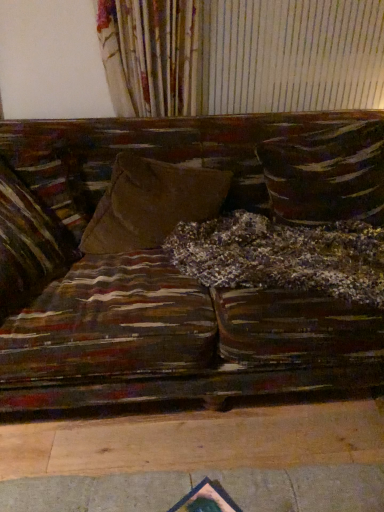
What do you see at coordinates (326, 172) in the screenshot? I see `textured brown pillow at center, the 3th pillow positioned from the left` at bounding box center [326, 172].

This screenshot has width=384, height=512. I want to click on textured brown pillow at center, the 1th pillow in the right-to-left sequence, so click(326, 172).

This screenshot has height=512, width=384. What do you see at coordinates (151, 203) in the screenshot?
I see `suede-like brown pillow at center, the second pillow when ordered from right to left` at bounding box center [151, 203].

This screenshot has width=384, height=512. Identify the location of textured brown pillow at center, the 1th pillow in the right-to-left sequence. (326, 172).

From a real-world perspective, which is physically below, suede-like brown pillow at center, which is the 2th pillow from left to right, or velvet brown pillow at left, positioned as the 3th pillow in right-to-left order?

suede-like brown pillow at center, which is the 2th pillow from left to right.

At what (x,y) coordinates should I click in order to perform the action: click on the 1st pillow above the velvet brown pillow at left, the 1th pillow positioned from the left (from the image's perspective). Please return your answer as a coordinate pair (x, y). Looking at the image, I should click on (151, 203).

Considering the sizes of objects suede-like brown pillow at center, which is the 2th pillow from left to right, and velvet brown pillow at left, the 1th pillow positioned from the left, in the image provided, who is bigger, suede-like brown pillow at center, which is the 2th pillow from left to right, or velvet brown pillow at left, the 1th pillow positioned from the left,?

suede-like brown pillow at center, which is the 2th pillow from left to right.

Is suede-like brown pillow at center, which is the 2th pillow from left to right, looking in the opposite direction of velvet brown pillow at left, positioned as the 3th pillow in right-to-left order?

No.

Is velvet brown pillow at left, the 1th pillow positioned from the left, positioned far away from suede-like brown pillow at center, which is the 2th pillow from left to right?

No.

Which is in front, point (24, 274) or point (147, 160)?

The point (24, 274) is in front.

From a real-world perspective, is velvet brown pillow at left, positioned as the 3th pillow in right-to-left order, above or below suede-like brown pillow at center, the second pillow when ordered from right to left?

In terms of real-world spatial position, velvet brown pillow at left, positioned as the 3th pillow in right-to-left order, is above suede-like brown pillow at center, the second pillow when ordered from right to left.

Considering the relative sizes of velvet brown pillow at left, positioned as the 3th pillow in right-to-left order, and textured brown pillow at center, the 3th pillow positioned from the left, in the image provided, is velvet brown pillow at left, positioned as the 3th pillow in right-to-left order, bigger than textured brown pillow at center, the 3th pillow positioned from the left,?

No, velvet brown pillow at left, positioned as the 3th pillow in right-to-left order, is not bigger than textured brown pillow at center, the 3th pillow positioned from the left.

Is velvet brown pillow at left, the 1th pillow positioned from the left, facing towards textured brown pillow at center, the 1th pillow in the right-to-left sequence?

No, velvet brown pillow at left, the 1th pillow positioned from the left, is not aimed at textured brown pillow at center, the 1th pillow in the right-to-left sequence.

Is velvet brown pillow at left, positioned as the 3th pillow in right-to-left order, taller than textured brown pillow at center, the 1th pillow in the right-to-left sequence?

Yes, velvet brown pillow at left, positioned as the 3th pillow in right-to-left order, is taller than textured brown pillow at center, the 1th pillow in the right-to-left sequence.

Between velvet brown pillow at left, positioned as the 3th pillow in right-to-left order, and textured brown pillow at center, the 3th pillow positioned from the left, which one appears on the right side from the viewer's perspective?

textured brown pillow at center, the 3th pillow positioned from the left, is more to the right.

Who is taller, textured brown pillow at center, the 3th pillow positioned from the left, or suede-like brown pillow at center, which is the 2th pillow from left to right?

textured brown pillow at center, the 3th pillow positioned from the left.

How many degrees apart are the facing directions of textured brown pillow at center, the 3th pillow positioned from the left, and suede-like brown pillow at center, which is the 2th pillow from left to right?

10.2 degrees.

Would you say textured brown pillow at center, the 1th pillow in the right-to-left sequence, is inside or outside suede-like brown pillow at center, the second pillow when ordered from right to left?

textured brown pillow at center, the 1th pillow in the right-to-left sequence, cannot be found inside suede-like brown pillow at center, the second pillow when ordered from right to left.

Does textured brown pillow at center, the 3th pillow positioned from the left, have a larger size compared to suede-like brown pillow at center, which is the 2th pillow from left to right?

Yes.

Between textured brown pillow at center, the 3th pillow positioned from the left, and velvet brown pillow at left, the 1th pillow positioned from the left, which one has larger size?

textured brown pillow at center, the 3th pillow positioned from the left.

Which object is further away from the camera, textured brown pillow at center, the 3th pillow positioned from the left, or velvet brown pillow at left, positioned as the 3th pillow in right-to-left order?

textured brown pillow at center, the 3th pillow positioned from the left, is more distant.

From a real-world perspective, is textured brown pillow at center, the 3th pillow positioned from the left, below velvet brown pillow at left, the 1th pillow positioned from the left?

Yes, from a real-world perspective, textured brown pillow at center, the 3th pillow positioned from the left, is under velvet brown pillow at left, the 1th pillow positioned from the left.

Does suede-like brown pillow at center, which is the 2th pillow from left to right, have a smaller size compared to textured brown pillow at center, the 3th pillow positioned from the left?

Yes.

Who is taller, suede-like brown pillow at center, which is the 2th pillow from left to right, or textured brown pillow at center, the 3th pillow positioned from the left?

textured brown pillow at center, the 3th pillow positioned from the left.

Can you confirm if suede-like brown pillow at center, which is the 2th pillow from left to right, is positioned to the right of textured brown pillow at center, the 1th pillow in the right-to-left sequence?

No, suede-like brown pillow at center, which is the 2th pillow from left to right, is not to the right of textured brown pillow at center, the 1th pillow in the right-to-left sequence.

Between point (146, 178) and point (349, 126), which one is positioned behind?

Positioned behind is point (349, 126).

You are a GUI agent. You are given a task and a screenshot of the screen. Output one action in this format:
    pyautogui.click(x=<x>, y=<y>)
    Task: Click on the pillow that is the 1st object located behind the velvet brown pillow at left, positioned as the 3th pillow in right-to-left order
    Image resolution: width=384 pixels, height=512 pixels.
    Given the screenshot: What is the action you would take?
    pyautogui.click(x=151, y=203)

From a real-world perspective, starting from the suede-like brown pillow at center, which is the 2th pillow from left to right, which pillow is the 2nd one vertically above it? Please provide its 2D coordinates.

[(28, 244)]

Estimate the real-world distances between objects in this image. Which object is closer to velvet brown pillow at left, the 1th pillow positioned from the left, suede-like brown pillow at center, the second pillow when ordered from right to left, or textured brown pillow at center, the 3th pillow positioned from the left?

suede-like brown pillow at center, the second pillow when ordered from right to left, lies closer to velvet brown pillow at left, the 1th pillow positioned from the left, than the other object.

Considering their positions, is velvet brown pillow at left, the 1th pillow positioned from the left, positioned further to textured brown pillow at center, the 3th pillow positioned from the left, than suede-like brown pillow at center, the second pillow when ordered from right to left?

velvet brown pillow at left, the 1th pillow positioned from the left, lies further to textured brown pillow at center, the 3th pillow positioned from the left, than the other object.

Considering their positions, is textured brown pillow at center, the 1th pillow in the right-to-left sequence, positioned further to velvet brown pillow at left, the 1th pillow positioned from the left, than suede-like brown pillow at center, which is the 2th pillow from left to right?

textured brown pillow at center, the 1th pillow in the right-to-left sequence.

From the picture: Considering their positions, is velvet brown pillow at left, the 1th pillow positioned from the left, positioned further to suede-like brown pillow at center, the second pillow when ordered from right to left, than textured brown pillow at center, the 3th pillow positioned from the left?

textured brown pillow at center, the 3th pillow positioned from the left, is positioned further to the anchor suede-like brown pillow at center, the second pillow when ordered from right to left.

Based on their spatial positions, is textured brown pillow at center, the 3th pillow positioned from the left, or velvet brown pillow at left, positioned as the 3th pillow in right-to-left order, closer to suede-like brown pillow at center, which is the 2th pillow from left to right?

velvet brown pillow at left, positioned as the 3th pillow in right-to-left order, is positioned closer to the anchor suede-like brown pillow at center, which is the 2th pillow from left to right.

Based on their spatial positions, is suede-like brown pillow at center, which is the 2th pillow from left to right, or velvet brown pillow at left, positioned as the 3th pillow in right-to-left order, further from textured brown pillow at center, the 1th pillow in the right-to-left sequence?

The object further to textured brown pillow at center, the 1th pillow in the right-to-left sequence, is velvet brown pillow at left, positioned as the 3th pillow in right-to-left order.

The width and height of the screenshot is (384, 512). Find the location of `pillow located between velvet brown pillow at left, positioned as the 3th pillow in right-to-left order, and textured brown pillow at center, the 1th pillow in the right-to-left sequence, in the left-right direction`. pillow located between velvet brown pillow at left, positioned as the 3th pillow in right-to-left order, and textured brown pillow at center, the 1th pillow in the right-to-left sequence, in the left-right direction is located at coordinates (151, 203).